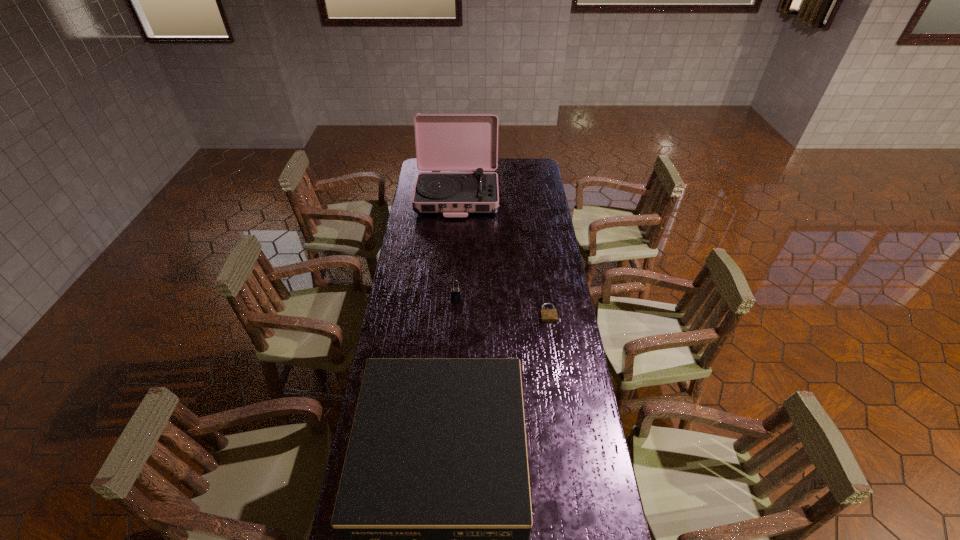
I want to click on free space that is in between the farthest object and the farther padlock, so click(457, 246).

Locate which object is the second closest to the left padlock. Please provide its 2D coordinates. Your answer should be formatted as a tuple, i.e. [(x, y)], where the tuple contains the x and y coordinates of a point satisfying the conditions above.

[(433, 511)]

Identify the location of object that stands as the closest to the farther padlock. (547, 315).